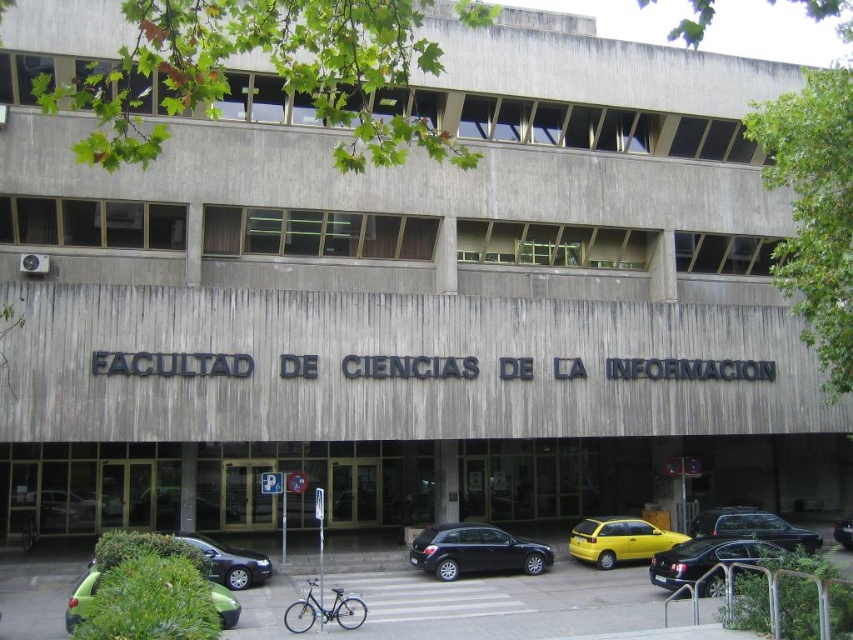
You are a delivery driver who needs to park your truck, which is 6 meters long, in the parking area near the FACULTAD DE CIENCIAS DE LA INFORMACION. The parking spots are marked by the signs you see. Can you determine if the shiny black hatchback at center or the green matte car at lower left has enough space to allow your truck to park between them?

The shiny black hatchback at center is smaller than the green matte car at lower left. However, the distance between them isn not provided in the Objects Description, so it is impossible to determine if there is enough space for the truck.

You are standing at the entrance of the FACULTAD DE CIENCIAS DE LA INFORMACION and need to locate the shiny black sedan at lower right. Based on the coordinates provided in the description, can you determine its position relative to the building?

The shiny black sedan at lower right is located at point coordinates [704,557]. This places it near the lower right corner of the image, which corresponds to the area just outside the building near the parking spaces indicated by the signs.